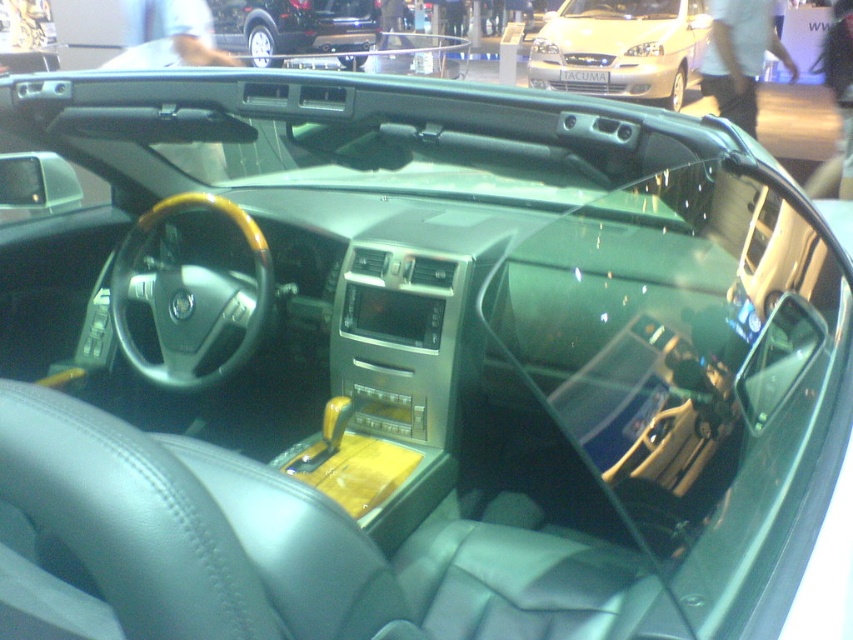
Who is higher up, silver metallic sedan at upper center or shiny black car at upper center?

shiny black car at upper center is higher up.

Does point (607, 90) come closer to viewer compared to point (358, 51)?

Yes, point (607, 90) is closer to viewer.

This screenshot has width=853, height=640. In order to click on silver metallic sedan at upper center in this screenshot , I will do `click(619, 49)`.